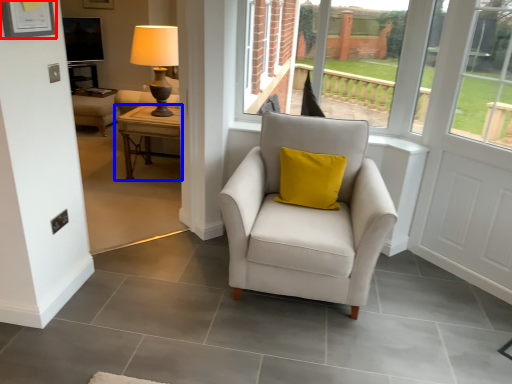
Question: Which point is closer to the camera, picture frame (highlighted by a red box) or table (highlighted by a blue box)?

Choices:
 (A) picture frame
 (B) table

Answer: (A)